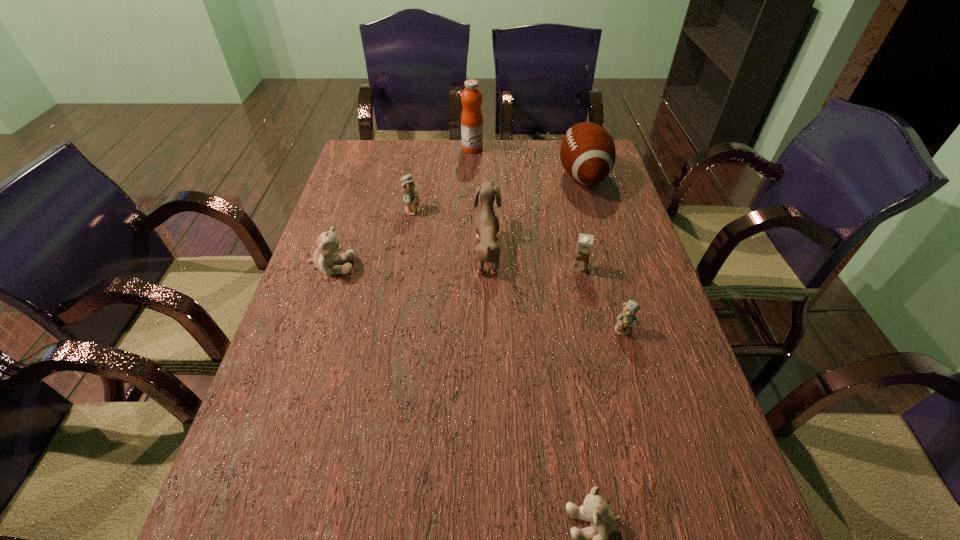
This screenshot has height=540, width=960. Find the location of `free point located on the front of the chocolate milk`. free point located on the front of the chocolate milk is located at coordinates (594, 336).

Image resolution: width=960 pixels, height=540 pixels. Find the location of `free space located on the front-facing side of the smaller blue teddy bear`. free space located on the front-facing side of the smaller blue teddy bear is located at coordinates (634, 362).

This screenshot has width=960, height=540. I want to click on fruit juice that is positioned at the far edge, so click(x=471, y=119).

You are a GUI agent. You are given a task and a screenshot of the screen. Output one action in this format:
    pyautogui.click(x=<x>, y=<y>)
    Task: Click on the football located in the far edge section of the desktop
    
    Given the screenshot: What is the action you would take?
    pyautogui.click(x=587, y=153)

Image resolution: width=960 pixels, height=540 pixels. What are the coordinates of `object at the left edge` in the screenshot? It's located at (324, 259).

What are the coordinates of `football located at the right edge` in the screenshot? It's located at (587, 153).

Where is `teddy bear that is positioned at the right edge`? Image resolution: width=960 pixels, height=540 pixels. teddy bear that is positioned at the right edge is located at coordinates (627, 319).

Locate an element on the screen. The width and height of the screenshot is (960, 540). object that is positioned at the far right corner is located at coordinates (587, 153).

In the image, there is a desktop. In order to click on vacant space at the far edge in this screenshot , I will do `click(418, 165)`.

This screenshot has height=540, width=960. In the image, there is a desktop. Identify the location of free space at the near edge. (339, 537).